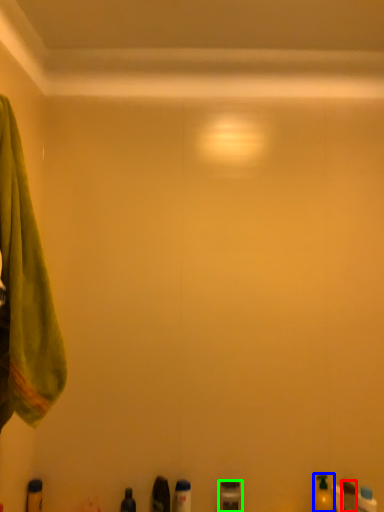
Question: Considering the real-world distances, which object is farthest from toiletry (highlighted by a red box)? toiletry (highlighted by a blue box) or toiletry (highlighted by a green box)?

Choices:
 (A) toiletry
 (B) toiletry

Answer: (B)